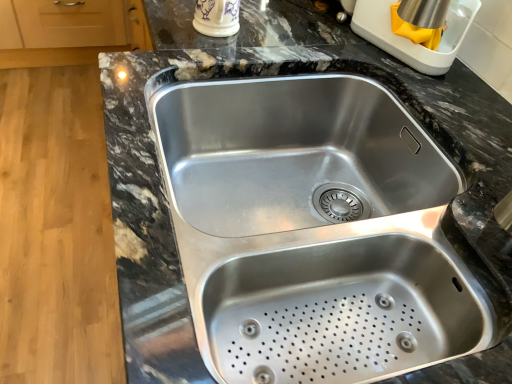
Question: Can you confirm if stainless steel sink at center is wider than porcelain cup at upper center, the first appliance positioned from the left?

Choices:
 (A) no
 (B) yes

Answer: (B)

Question: Is stainless steel sink at center in contact with porcelain cup at upper center, the first appliance positioned from the left?

Choices:
 (A) yes
 (B) no

Answer: (B)

Question: Is stainless steel sink at center not within porcelain cup at upper center, the first appliance positioned from the left?

Choices:
 (A) no
 (B) yes

Answer: (B)

Question: Considering the relative sizes of stainless steel sink at center and porcelain cup at upper center, the 2th appliance viewed from the right, in the image provided, is stainless steel sink at center shorter than porcelain cup at upper center, the 2th appliance viewed from the right,?

Choices:
 (A) yes
 (B) no

Answer: (B)

Question: Does stainless steel sink at center have a greater height compared to porcelain cup at upper center, the first appliance positioned from the left?

Choices:
 (A) yes
 (B) no

Answer: (A)

Question: Considering the positions of point (408, 49) and point (210, 13), is point (408, 49) closer or farther from the camera than point (210, 13)?

Choices:
 (A) farther
 (B) closer

Answer: (B)

Question: In terms of size, does stainless steel kettle at upper right, which ranks as the first appliance in right-to-left order, appear bigger or smaller than porcelain cup at upper center, the first appliance positioned from the left?

Choices:
 (A) small
 (B) big

Answer: (B)

Question: Is stainless steel kettle at upper right, which ranks as the first appliance in right-to-left order, in front of or behind porcelain cup at upper center, the 2th appliance viewed from the right, in the image?

Choices:
 (A) behind
 (B) front

Answer: (B)

Question: From the image's perspective, is stainless steel kettle at upper right, the second appliance when ordered from left to right, located above or below porcelain cup at upper center, the first appliance positioned from the left?

Choices:
 (A) below
 (B) above

Answer: (A)

Question: Would you say stainless steel sink at center is inside or outside stainless steel kettle at upper right, the second appliance when ordered from left to right?

Choices:
 (A) outside
 (B) inside

Answer: (A)

Question: Based on their positions, is stainless steel sink at center located to the left or right of stainless steel kettle at upper right, the second appliance when ordered from left to right?

Choices:
 (A) right
 (B) left

Answer: (B)

Question: Is stainless steel sink at center bigger or smaller than stainless steel kettle at upper right, which ranks as the first appliance in right-to-left order?

Choices:
 (A) small
 (B) big

Answer: (B)

Question: Considering the positions of stainless steel sink at center and stainless steel kettle at upper right, which ranks as the first appliance in right-to-left order, in the image, is stainless steel sink at center taller or shorter than stainless steel kettle at upper right, which ranks as the first appliance in right-to-left order,?

Choices:
 (A) tall
 (B) short

Answer: (A)

Question: Based on their positions, is porcelain cup at upper center, the first appliance positioned from the left, located to the left or right of stainless steel kettle at upper right, the second appliance when ordered from left to right?

Choices:
 (A) left
 (B) right

Answer: (A)

Question: Does point (207, 24) appear closer or farther from the camera than point (390, 23)?

Choices:
 (A) farther
 (B) closer

Answer: (A)